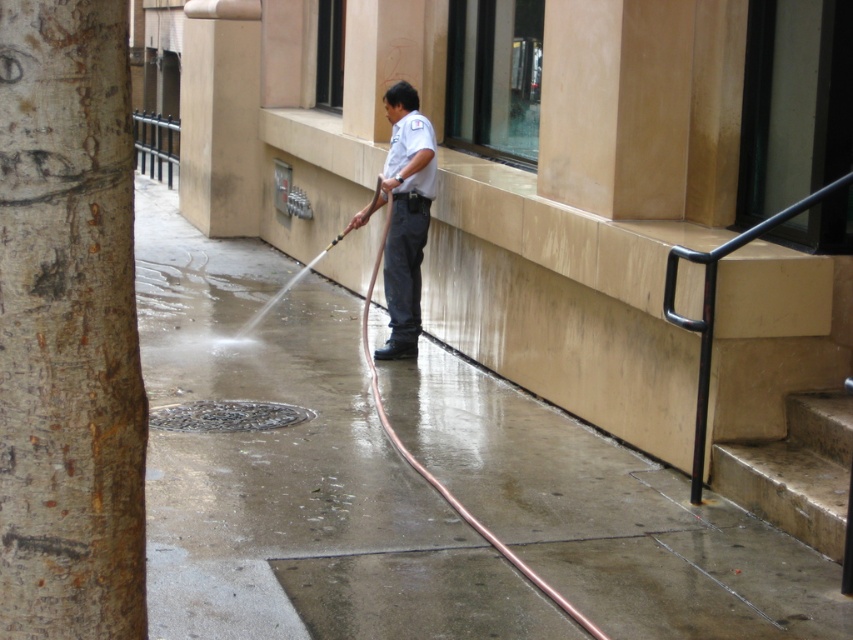
You are standing at the entrance of the building and want to water the tree using the hose. The smooth bark tree trunk at left and the white uniform at center are in your line of sight. Which object should you move closer to in order to reach the tree trunk with the hose?

The smooth bark tree trunk at left is closer to the viewer than the white uniform at center, so you should move closer to the smooth bark tree trunk at left to reach it with the hose.

You are standing 3 meters away from the building. If you walk towards the smooth bark tree trunk at left, will you get closer to the building or farther away?

The smooth bark tree trunk at left is 2.85 meters away from the viewer. Since you are currently 3 meters away from the building, walking towards the tree trunk would mean moving closer to the building as the tree is closer than your current position. Therefore, you will get closer to the building.